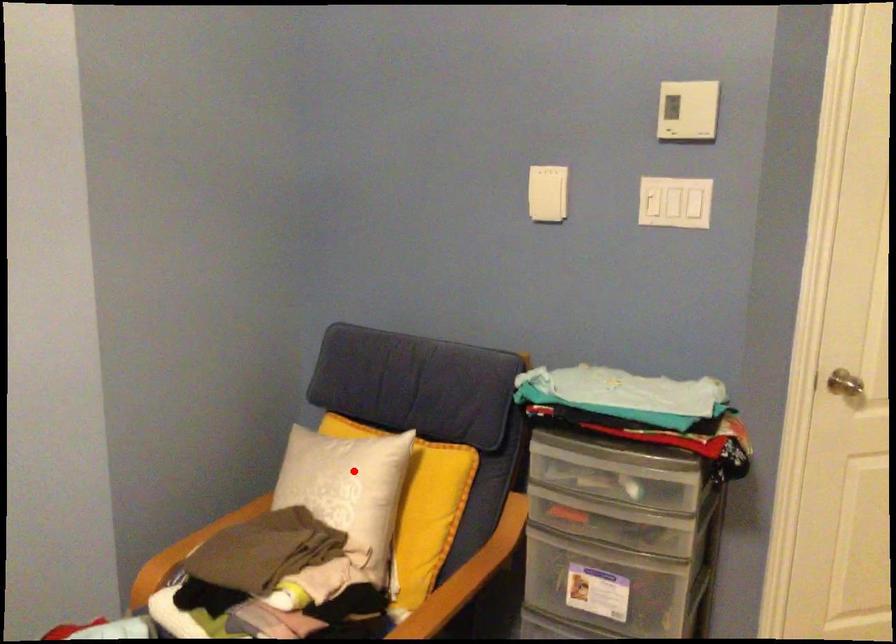
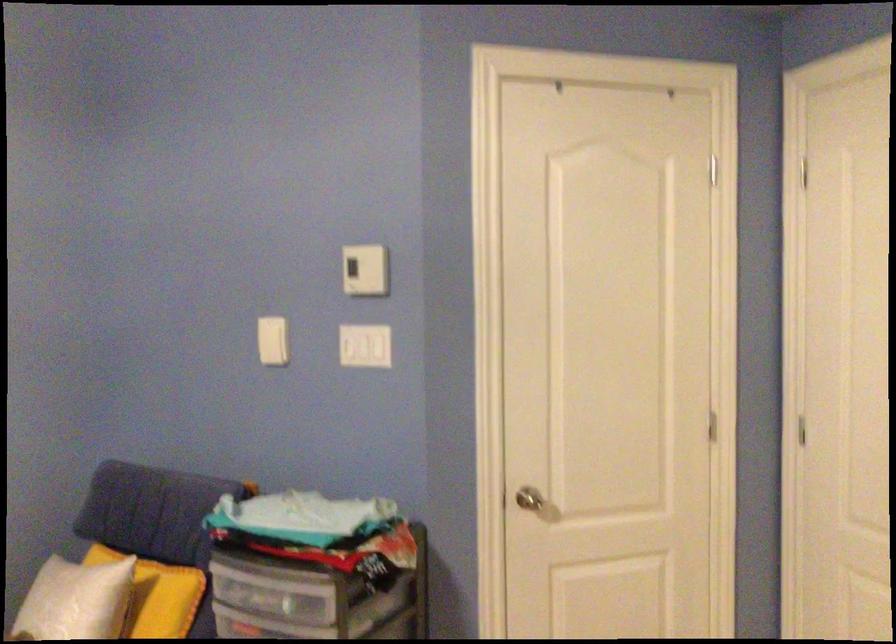
Where in the second image is the point corresponding to the highlighted location from the first image?

(74, 601)